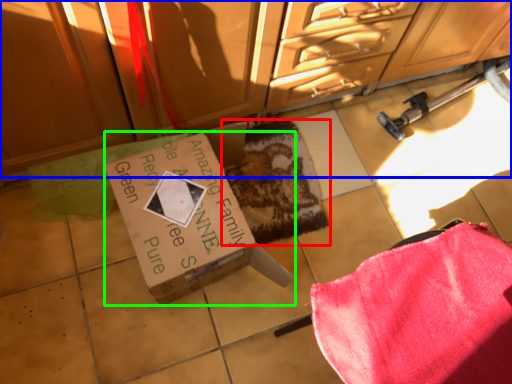
Question: Based on their relative distances, which object is farther from mat (highlighted by a red box)? Choose from cabinetry (highlighted by a blue box) and box (highlighted by a green box).

Choices:
 (A) cabinetry
 (B) box

Answer: (A)